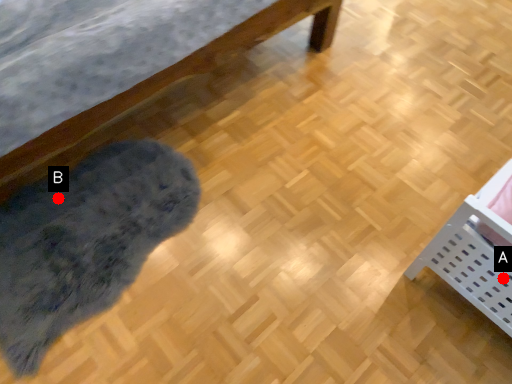
Question: Two points are circled on the image, labeled by A and B beside each circle. Which point is closer to the camera?

Choices:
 (A) A is closer
 (B) B is closer

Answer: (A)